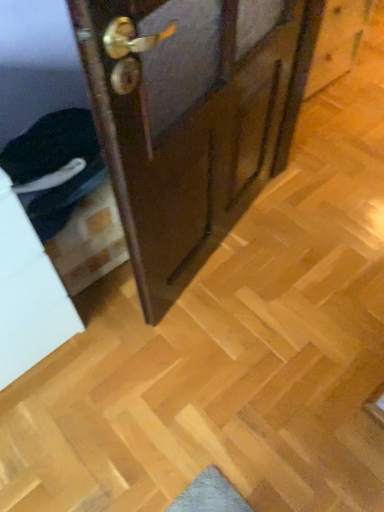
The width and height of the screenshot is (384, 512). In order to click on vacant space to the right of wooden door at center in this screenshot , I will do `click(286, 250)`.